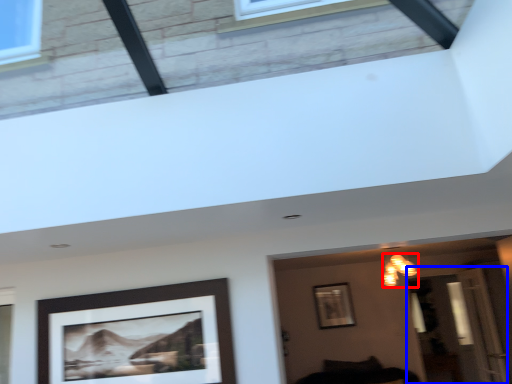
Question: Which object is closer to the camera taking this photo, light fixture (highlighted by a red box) or glass door (highlighted by a blue box)?

Choices:
 (A) light fixture
 (B) glass door

Answer: (A)